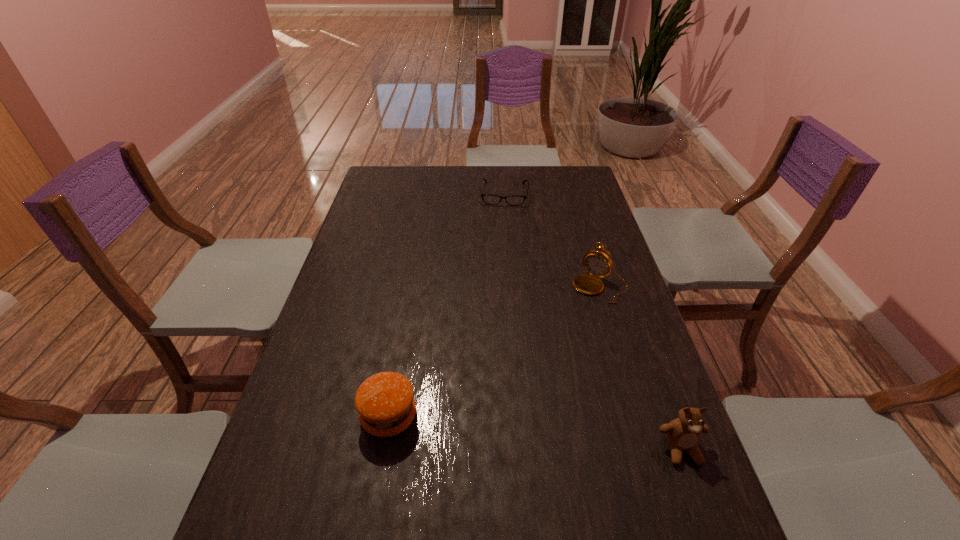
What are the coordinates of `free space at the right edge of the desktop` in the screenshot? It's located at (636, 324).

You are a GUI agent. You are given a task and a screenshot of the screen. Output one action in this format:
    pyautogui.click(x=<x>, y=<y>)
    Task: Click on the vacant area at the far right corner of the desktop
    The width and height of the screenshot is (960, 540).
    Given the screenshot: What is the action you would take?
    pyautogui.click(x=577, y=177)

This screenshot has width=960, height=540. What are the coordinates of `free spot between the pocket watch and the second shortest object` in the screenshot? It's located at (494, 352).

Where is `unoccupied position between the second shortest object and the pocket watch`? The width and height of the screenshot is (960, 540). unoccupied position between the second shortest object and the pocket watch is located at coordinates (494, 352).

I want to click on free spot between the shortest object and the third nearest object, so click(552, 240).

Where is `vacant area that lies between the third nearest object and the patty`? vacant area that lies between the third nearest object and the patty is located at coordinates (494, 352).

Where is `vacant point located between the third nearest object and the patty`? This screenshot has width=960, height=540. vacant point located between the third nearest object and the patty is located at coordinates (494, 352).

This screenshot has height=540, width=960. Identify the location of vacant area that lies between the shortest object and the second farthest object. (552, 240).

This screenshot has height=540, width=960. In order to click on vacant point located between the leftmost object and the teddy bear in this screenshot , I will do `click(536, 433)`.

Locate an element on the screen. Image resolution: width=960 pixels, height=540 pixels. vacant area between the third tallest object and the third nearest object is located at coordinates (494, 352).